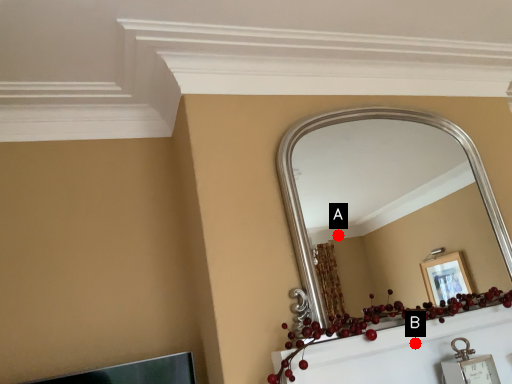
Question: Two points are circled on the image, labeled by A and B beside each circle. Which point is farther from the camera taking this photo?

Choices:
 (A) A is further
 (B) B is further

Answer: (A)